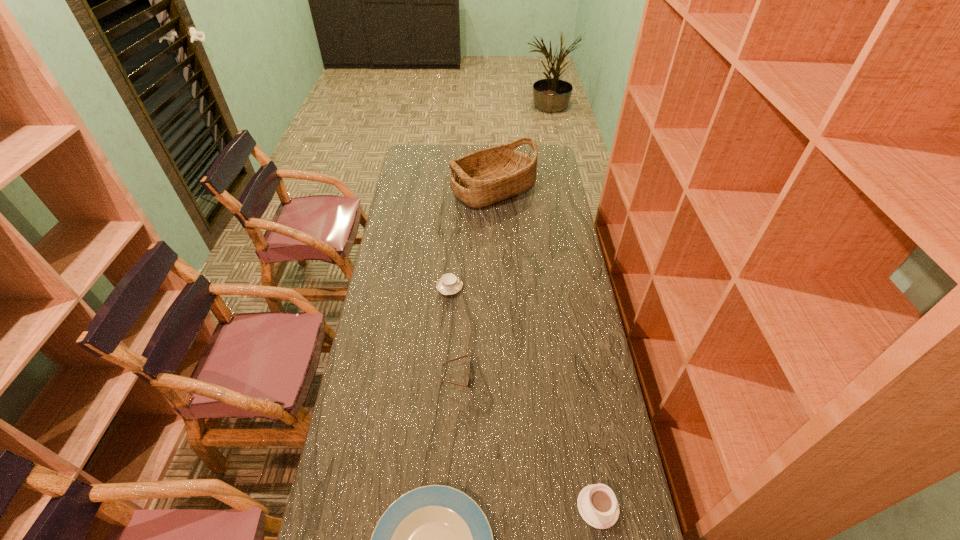
I want to click on unoccupied position between the right teacup and the left teacup, so click(524, 397).

The image size is (960, 540). I want to click on vacant area between the left teacup and the sunglasses, so click(x=453, y=332).

At what (x,y) coordinates should I click in order to perform the action: click on vacant area that lies between the nearer teacup and the sunglasses. Please return your answer as a coordinate pair (x, y). This screenshot has width=960, height=540. Looking at the image, I should click on (527, 441).

You are a GUI agent. You are given a task and a screenshot of the screen. Output one action in this format:
    pyautogui.click(x=<x>, y=<y>)
    Task: Click on the empty space that is in between the farthest object and the right teacup
    The width and height of the screenshot is (960, 540).
    Given the screenshot: What is the action you would take?
    pyautogui.click(x=545, y=348)

Identify the location of free area in between the third farthest object and the right teacup. This screenshot has height=540, width=960. (527, 441).

Find the location of a particular element. object that can be found as the fourth closest to the sunglasses is located at coordinates (487, 176).

Identify which object is located as the second nearest to the sunglasses. Please provide its 2D coordinates. Your answer should be formatted as a tuple, i.e. [(x, y)], where the tuple contains the x and y coordinates of a point satisfying the conditions above.

[(435, 539)]

Where is `vacant region that satisfies the following two spatial constraints: 1. on the front side of the farthest object; 2. on the frames of the sunglasses`? The width and height of the screenshot is (960, 540). vacant region that satisfies the following two spatial constraints: 1. on the front side of the farthest object; 2. on the frames of the sunglasses is located at coordinates (500, 376).

In order to click on free spot that satisfies the following two spatial constraints: 1. on the frames of the sunglasses; 2. on the handle side of the right teacup in this screenshot , I will do pyautogui.click(x=451, y=507).

Find the location of a particular element. This screenshot has width=960, height=540. vacant space that satisfies the following two spatial constraints: 1. on the frames of the sunglasses; 2. on the handle side of the nearer teacup is located at coordinates (451, 507).